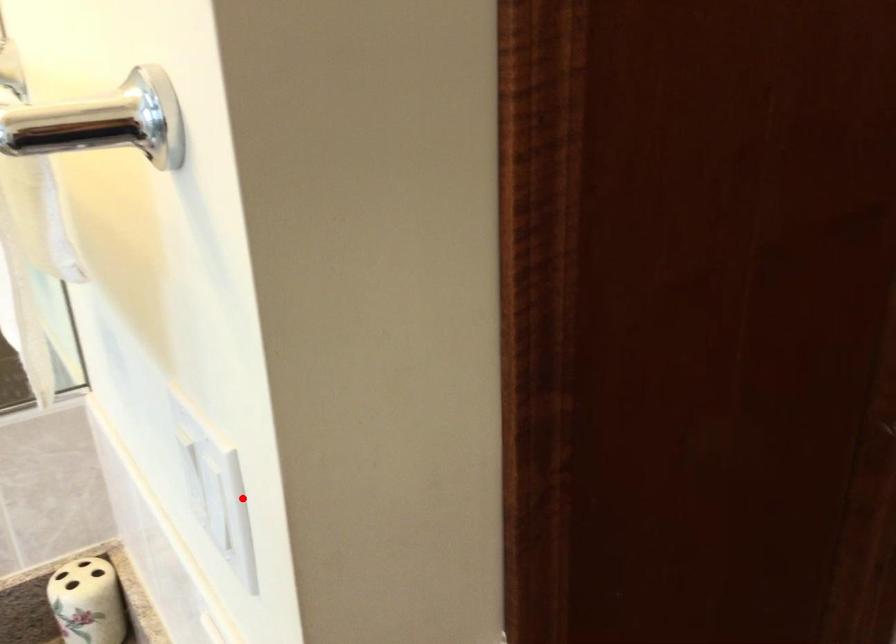
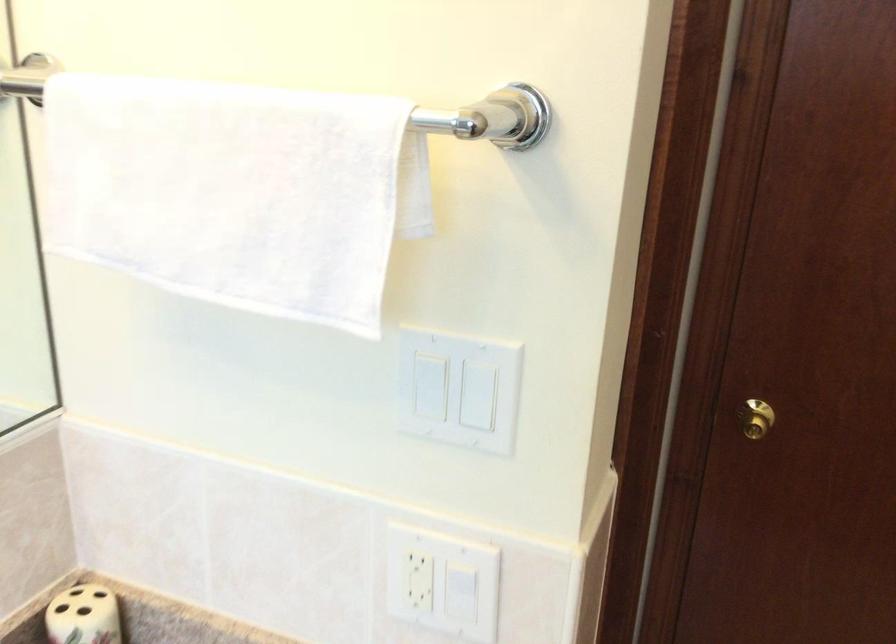
Find the pixel in the second image that matches the highlighted location in the first image.

(483, 395)